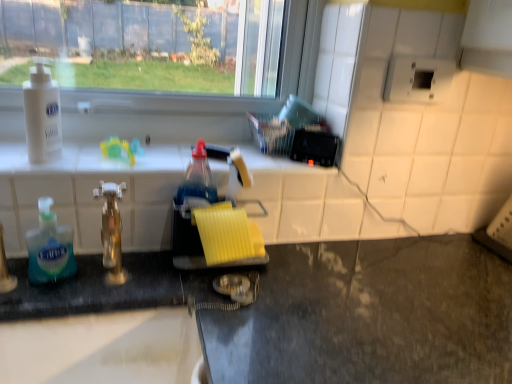
Question: Would you say yellow sponge at center is to the left or to the right of gold metallic faucet at center in the picture?

Choices:
 (A) right
 (B) left

Answer: (A)

Question: Is yellow sponge at center situated inside gold metallic faucet at center or outside?

Choices:
 (A) outside
 (B) inside

Answer: (A)

Question: Which is nearer to the white plastic outlet at upper right?

Choices:
 (A) white matte lotion at upper left, which ranks as the 2th bottle in bottom-to-top order
 (B) yellow sponge at center
 (C) black granite counter at lower left
 (D) gold metallic faucet at center
 (E) translucent plastic soap dispenser at left, arranged as the 1th bottle when ordered from the bottom

Answer: (B)

Question: Which of these objects is positioned farthest from the gold metallic faucet at center?

Choices:
 (A) yellow sponge at center
 (B) black granite counter at lower left
 (C) translucent plastic soap dispenser at left, the 2th bottle positioned from the top
 (D) white plastic outlet at upper right
 (E) white matte lotion at upper left, which ranks as the 2th bottle in bottom-to-top order

Answer: (D)